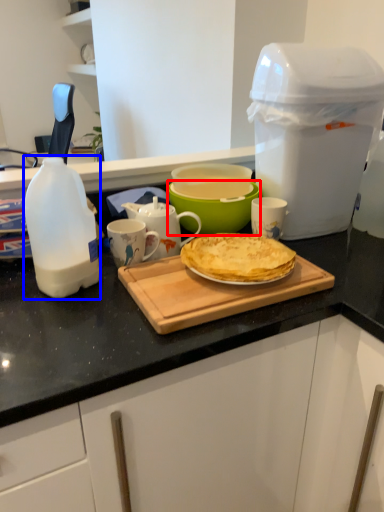
Question: Which object is closer to the camera taking this photo, bowl (highlighted by a red box) or bottle (highlighted by a blue box)?

Choices:
 (A) bowl
 (B) bottle

Answer: (B)